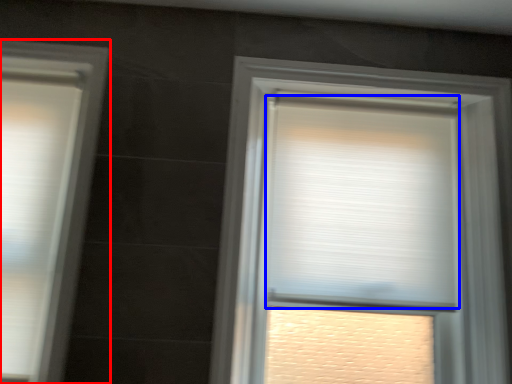
Question: Which point is further to the camera, window (highlighted by a red box) or window blind (highlighted by a blue box)?

Choices:
 (A) window
 (B) window blind

Answer: (B)